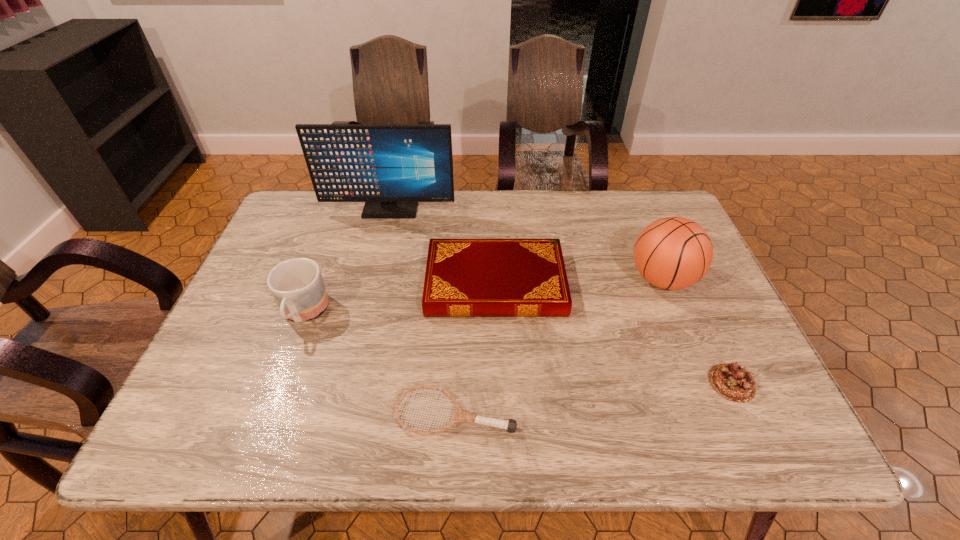
The image size is (960, 540). In order to click on the farthest object in this screenshot , I will do [391, 167].

The width and height of the screenshot is (960, 540). In order to click on computer monitor in this screenshot , I will do coord(391,167).

You are a GUI agent. You are given a task and a screenshot of the screen. Output one action in this format:
    pyautogui.click(x=<x>, y=<y>)
    Task: Click on the fifth shortest object
    
    Given the screenshot: What is the action you would take?
    pyautogui.click(x=673, y=253)

Locate an element on the screen. mug is located at coordinates (297, 285).

Identify the location of hardback book. This screenshot has width=960, height=540. (464, 277).

Image resolution: width=960 pixels, height=540 pixels. What are the coordinates of `chocolate cake` in the screenshot? It's located at (731, 381).

You are a GUI agent. You are given a task and a screenshot of the screen. Output one action in this format:
    pyautogui.click(x=<x>, y=<y>)
    Task: Click on the shortest object
    
    Given the screenshot: What is the action you would take?
    pyautogui.click(x=459, y=415)

In order to click on free location located on the screen side of the computer monitor in this screenshot , I will do `click(367, 308)`.

At what (x,y) coordinates should I click in order to perform the action: click on free space located 0.110m on the back of the basketball. Please return your answer as a coordinate pair (x, y). Looking at the image, I should click on (642, 231).

Locate an element on the screen. The width and height of the screenshot is (960, 540). free spot located on the side with the handle of the mug is located at coordinates (284, 366).